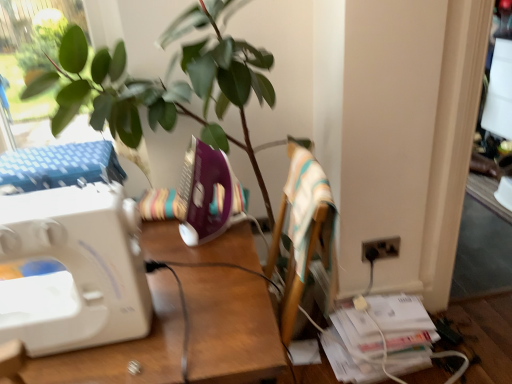
Question: Is purple plastic sewing machine at center, which is the first sewing machine in right-to-left order, smaller than white plastic sewing machine at left, placed as the 2th sewing machine when sorted from right to left?

Choices:
 (A) no
 (B) yes

Answer: (B)

Question: Is purple plastic sewing machine at center, the second sewing machine when ordered from left to right, taller than white plastic sewing machine at left, the first sewing machine viewed from the left?

Choices:
 (A) no
 (B) yes

Answer: (A)

Question: Is purple plastic sewing machine at center, arranged as the first sewing machine when viewed from the back, to the left of white plastic sewing machine at left, the 2th sewing machine in the back-to-front sequence, from the viewer's perspective?

Choices:
 (A) yes
 (B) no

Answer: (B)

Question: From the image's perspective, would you say purple plastic sewing machine at center, arranged as the first sewing machine when viewed from the back, is shown under white plastic sewing machine at left, placed as the 2th sewing machine when sorted from right to left?

Choices:
 (A) no
 (B) yes

Answer: (A)

Question: Can you confirm if purple plastic sewing machine at center, acting as the 2th sewing machine starting from the front, is wider than white plastic sewing machine at left, the 2th sewing machine in the back-to-front sequence?

Choices:
 (A) yes
 (B) no

Answer: (B)

Question: Is black plastic electric outlet at lower right situated inside white plastic sewing machine at left or outside?

Choices:
 (A) inside
 (B) outside

Answer: (B)

Question: Is black plastic electric outlet at lower right wider or thinner than white plastic sewing machine at left?

Choices:
 (A) wide
 (B) thin

Answer: (B)

Question: Is black plastic electric outlet at lower right bigger or smaller than white plastic sewing machine at left?

Choices:
 (A) small
 (B) big

Answer: (A)

Question: From a real-world perspective, is black plastic electric outlet at lower right above or below white plastic sewing machine at left?

Choices:
 (A) below
 (B) above

Answer: (B)

Question: Relative to purple plastic sewing machine at center, which is the first sewing machine in right-to-left order, is white plastic sewing machine at left in front or behind?

Choices:
 (A) behind
 (B) front

Answer: (B)

Question: Would you say white plastic sewing machine at left is to the left or to the right of purple plastic sewing machine at center, arranged as the first sewing machine when viewed from the back, in the picture?

Choices:
 (A) left
 (B) right

Answer: (A)

Question: From a real-world perspective, is white plastic sewing machine at left positioned above or below purple plastic sewing machine at center, acting as the 2th sewing machine starting from the front?

Choices:
 (A) below
 (B) above

Answer: (A)

Question: Is white plastic sewing machine at left inside or outside of purple plastic sewing machine at center, which is the first sewing machine in right-to-left order?

Choices:
 (A) inside
 (B) outside

Answer: (B)

Question: From the image's perspective, is white plastic sewing machine at left positioned above or below black plastic electric outlet at lower right?

Choices:
 (A) above
 (B) below

Answer: (B)

Question: Considering the positions of white plastic sewing machine at left and black plastic electric outlet at lower right in the image, is white plastic sewing machine at left taller or shorter than black plastic electric outlet at lower right?

Choices:
 (A) tall
 (B) short

Answer: (A)